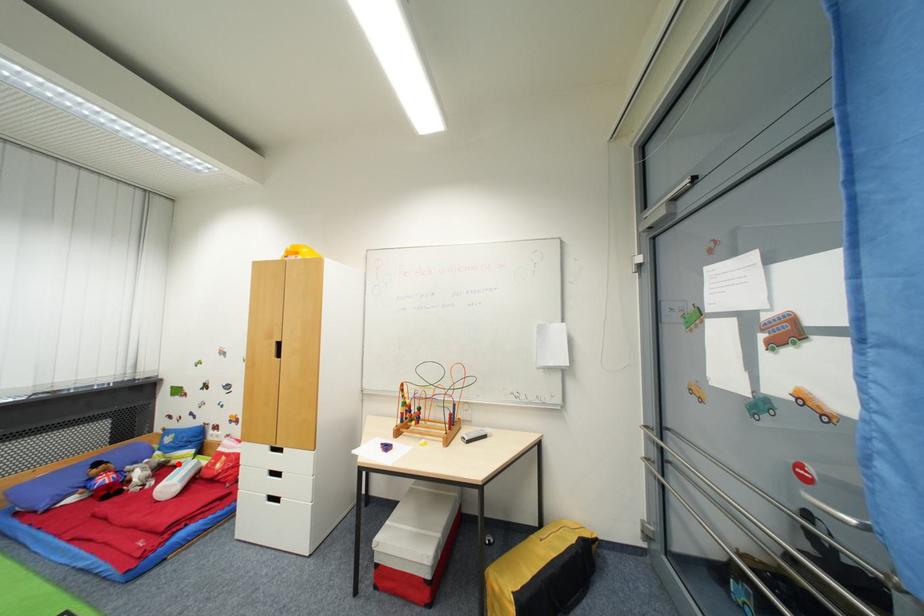
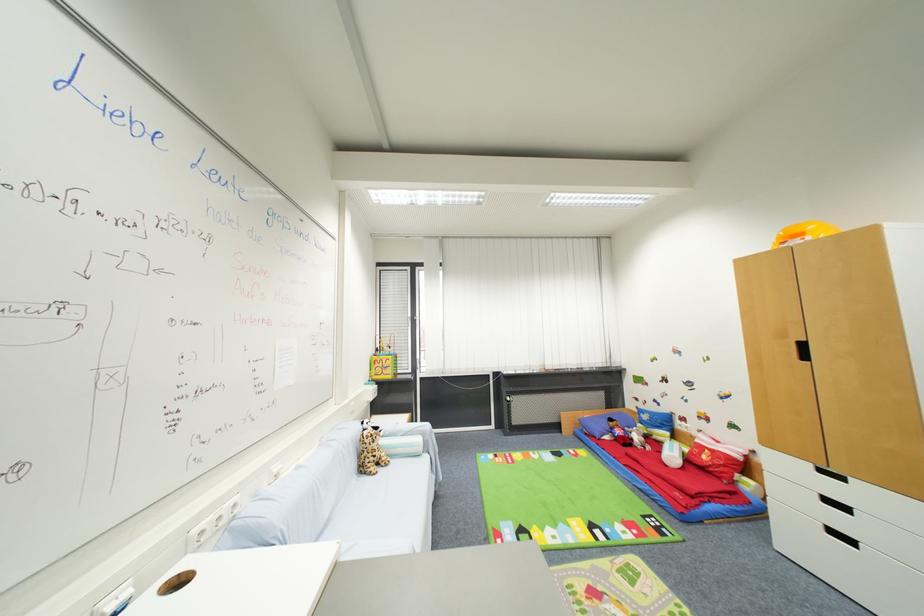
Question: I am providing you with two images of the same scene from different viewpoints. In image1, a red point is highlighted. Considering the same 3D point in image2, which of the following is correct?

Choices:
 (A) It is closer
 (B) It is farther

Answer: (B)